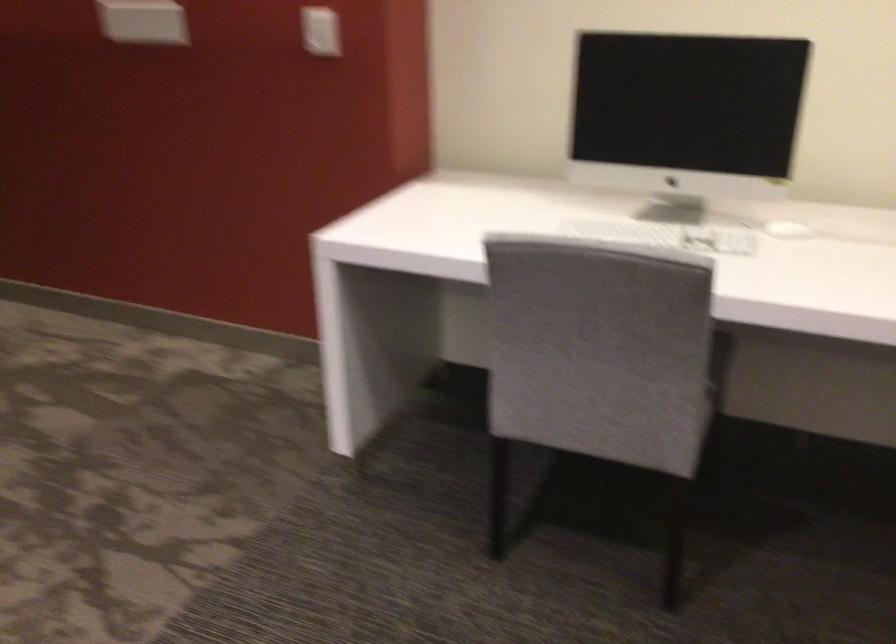
Based on the continuous images, in which direction is the camera rotating?

The camera's rotation is toward right-up.